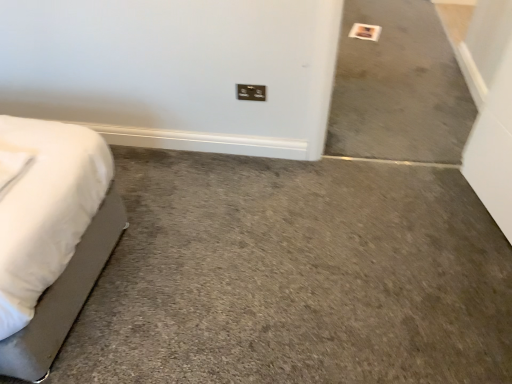
What do you see at coordinates (251, 92) in the screenshot?
I see `black plastic electric outlet at center` at bounding box center [251, 92].

Find the location of a particular element. black plastic electric outlet at center is located at coordinates (251, 92).

What are the coordinates of `black plastic electric outlet at center` in the screenshot? It's located at (251, 92).